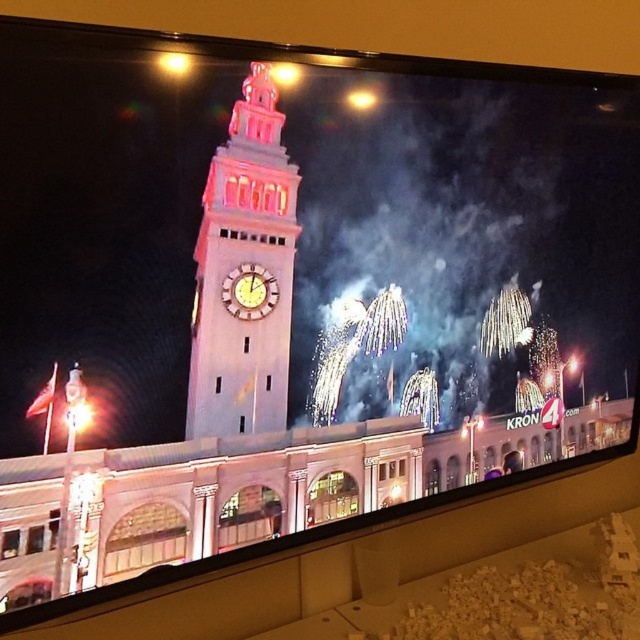
Can you confirm if white stone clock tower at center is smaller than gold metallic clock at center?

No, white stone clock tower at center is not smaller than gold metallic clock at center.

Which is below, white stone clock tower at center or gold metallic clock at center?

gold metallic clock at center

You are a GUI agent. You are given a task and a screenshot of the screen. Output one action in this format:
    pyautogui.click(x=<x>, y=<y>)
    Task: Click on the white stone clock tower at center
    The image size is (640, 640).
    Given the screenshot: What is the action you would take?
    pyautogui.click(x=244, y=273)